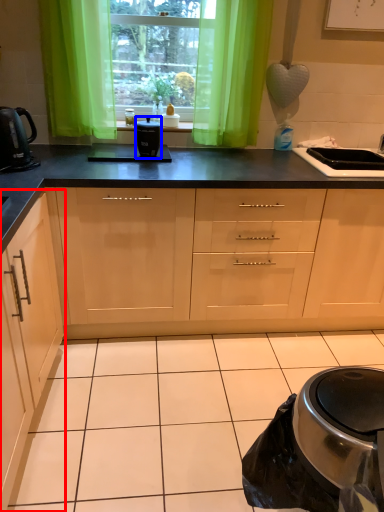
Question: Which point is closer to the camera, cabinetry (highlighted by a red box) or kitchen appliance (highlighted by a blue box)?

Choices:
 (A) cabinetry
 (B) kitchen appliance

Answer: (A)